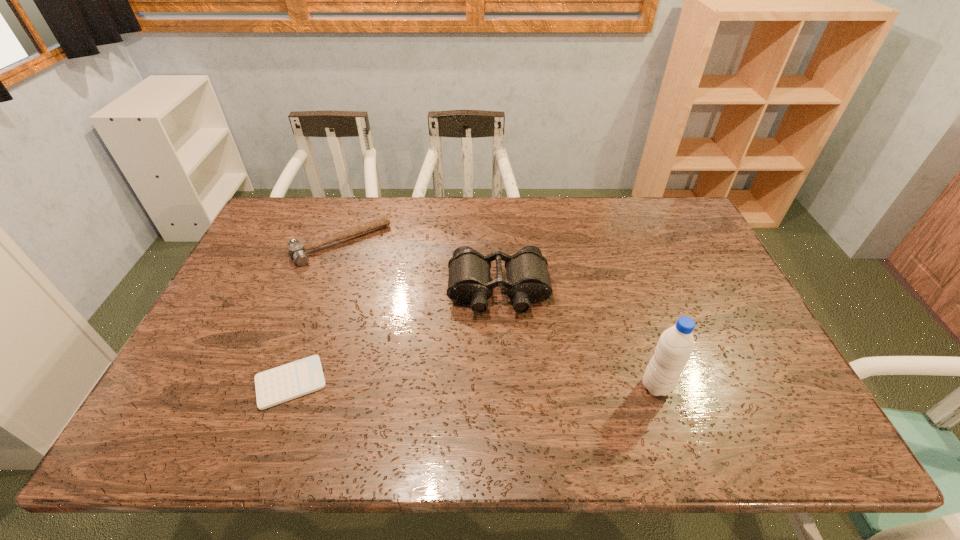
Where is `vacant space located 0.080m on the striking face of the hammer`? The height and width of the screenshot is (540, 960). vacant space located 0.080m on the striking face of the hammer is located at coordinates (369, 280).

Find the location of a particular element. The width and height of the screenshot is (960, 540). vacant space positioned 0.220m through the eyepieces of the binoculars is located at coordinates (505, 389).

This screenshot has height=540, width=960. In order to click on vacant space located through the eyepieces of the binoculars in this screenshot , I will do `click(504, 386)`.

This screenshot has height=540, width=960. Identify the location of free region located through the eyepieces of the binoculars. (503, 371).

Locate an element on the screen. The width and height of the screenshot is (960, 540). object located at the far edge is located at coordinates (297, 251).

Where is `calculator positioned at the near edge`? calculator positioned at the near edge is located at coordinates (275, 386).

This screenshot has width=960, height=540. Find the location of `water bottle that is at the near edge`. water bottle that is at the near edge is located at coordinates (676, 344).

At what (x,y) coordinates should I click in order to perform the action: click on object that is at the left edge. Please return your answer as a coordinate pair (x, y). Looking at the image, I should click on (297, 251).

Where is `object present at the far left corner`? The image size is (960, 540). object present at the far left corner is located at coordinates (297, 251).

The width and height of the screenshot is (960, 540). I want to click on vacant space at the far edge, so click(x=320, y=219).